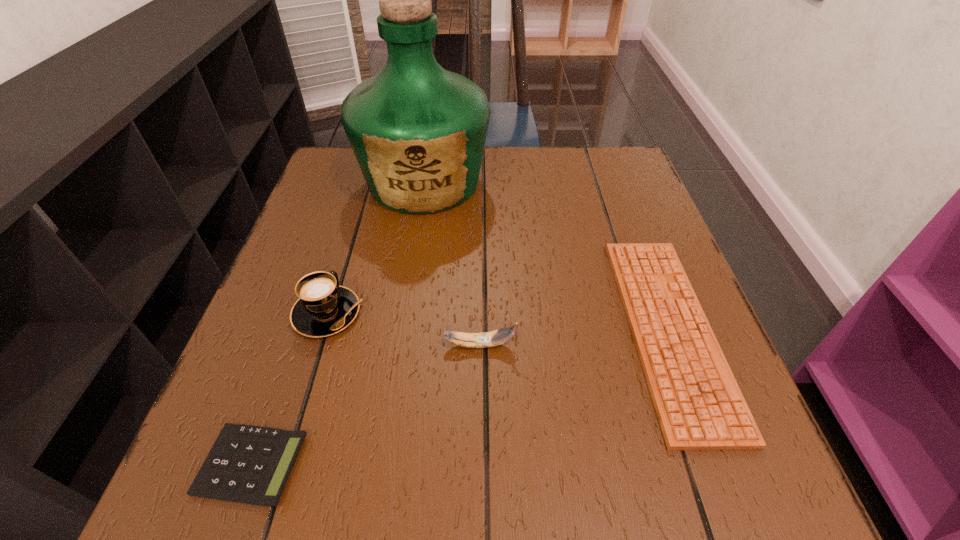
Locate an element on the screen. object that is at the near right corner is located at coordinates (699, 405).

Where is `free space at the far edge`? This screenshot has width=960, height=540. free space at the far edge is located at coordinates (533, 148).

I want to click on free spot at the left edge of the desktop, so click(x=363, y=219).

Identify the location of vacant region at the right edge of the desktop. (601, 268).

In the image, there is a desktop. At what (x,y) coordinates should I click in order to perform the action: click on vacant space at the far left corner. Please return your answer as a coordinate pair (x, y). Looking at the image, I should click on (338, 148).

Find the location of `free point at the far right corner`. free point at the far right corner is located at coordinates (592, 161).

The height and width of the screenshot is (540, 960). What are the coordinates of `free space at the near right corner` in the screenshot? It's located at tap(673, 485).

Image resolution: width=960 pixels, height=540 pixels. Identify the location of unoccupied area between the computer keyboard and the tallest object. (546, 256).

This screenshot has height=540, width=960. Identify the location of free space between the liquor and the rightmost object. coord(546,256).

Where is `free spot between the cappuccino and the computer keyboard`? Image resolution: width=960 pixels, height=540 pixels. free spot between the cappuccino and the computer keyboard is located at coordinates (x=498, y=321).